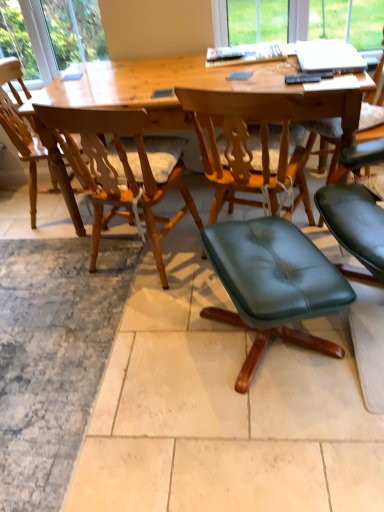
Locate an element on the screen. This screenshot has width=384, height=512. vacant space in front of green leather ottoman at lower right, marked as the 2th chair in a right-to-left arrangement is located at coordinates (278, 440).